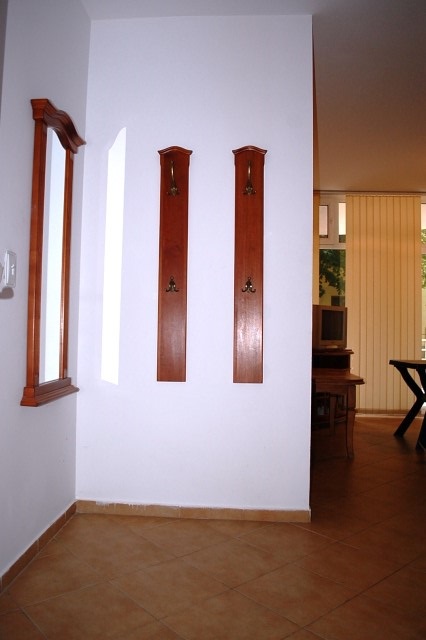
Locate an element on the screen. This screenshot has height=640, width=426. furniture leg is located at coordinates (412, 409).